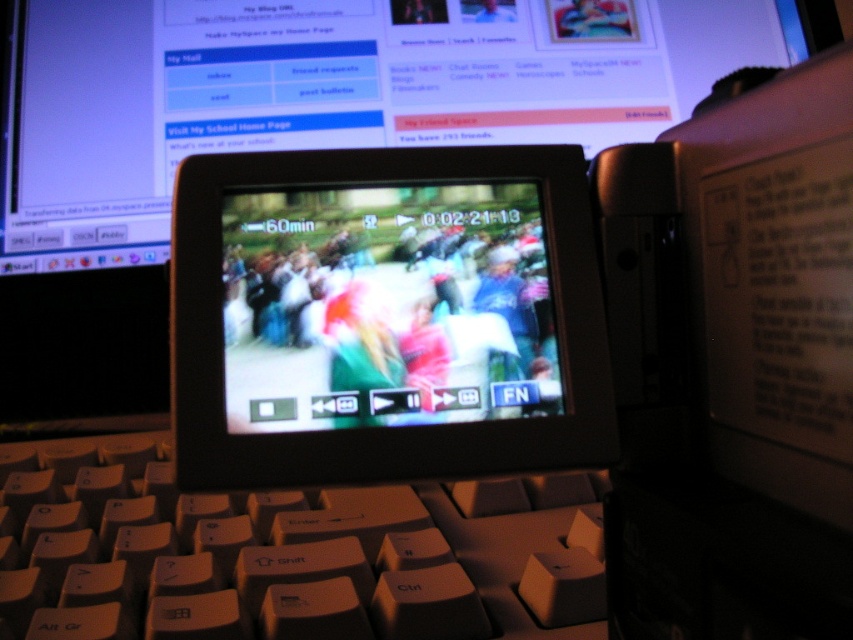
Based on the photo, you are setting up a video call and need to adjust your position so that both the black glossy screen at center and the beige plastic keyboard at center are visible in your frame. Based on their positions, which object should you move closer to you to achieve this?

The black glossy screen at center is already closer to the viewer than the beige plastic keyboard at center. To ensure both are visible, you should move the beige plastic keyboard at center closer to you so it aligns with the black glossy screen at center in the frame.

You are setting up a desk for a video editing session. You have a black glossy screen at center and a beige plastic keyboard at center. Which object should you place closer to the edge of the desk to save space?

The black glossy screen at center is smaller than the beige plastic keyboard at center, so placing the beige plastic keyboard at center closer to the edge would save more space since it takes up more room.